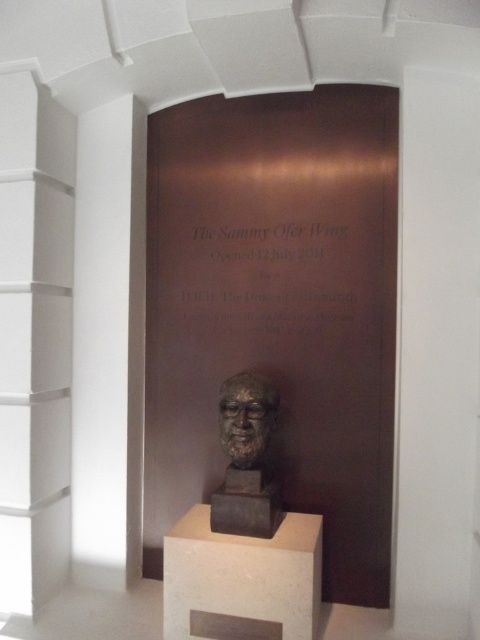
Consider the image. You are standing in the museum and want to take a photo of the bronze bust at center. To ensure the plaque behind it is fully visible in the frame, where should you position yourself relative to the bust?

Since the bronze bust at center is positioned at coordinates 0.845 on the x and 0.506 on the y axis, you should position yourself to the left side of the bust to ensure the plaque mounted behind it on the wall is fully visible in the photo.

What is the spatial relationship between the bronze bust at center and the bronze sculpture at center?

The bronze bust at center is to the right of the bronze sculpture at center.